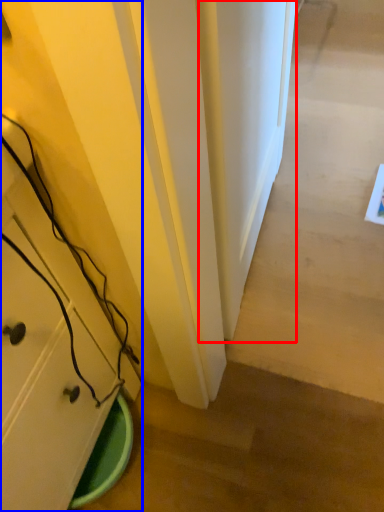
Question: Which point is closer to the camera, door (highlighted by a red box) or cabinetry (highlighted by a blue box)?

Choices:
 (A) door
 (B) cabinetry

Answer: (B)